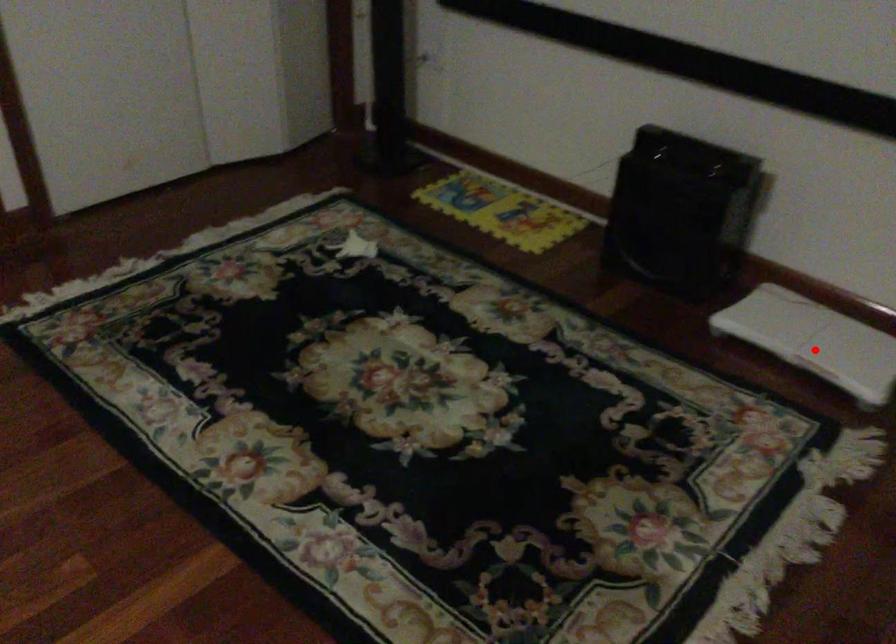
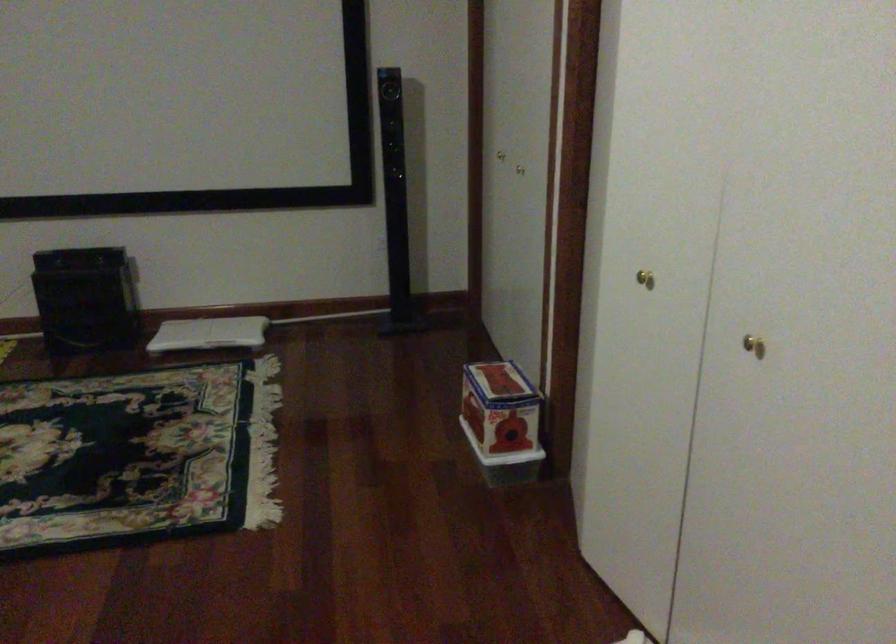
Question: A red point is marked in image1. In image2, is the corresponding 3D point closer to the camera or farther? Reply with the corresponding letter.

Choices:
 (A) The corresponding 3D point is closer.
 (B) The corresponding 3D point is farther.

Answer: (B)